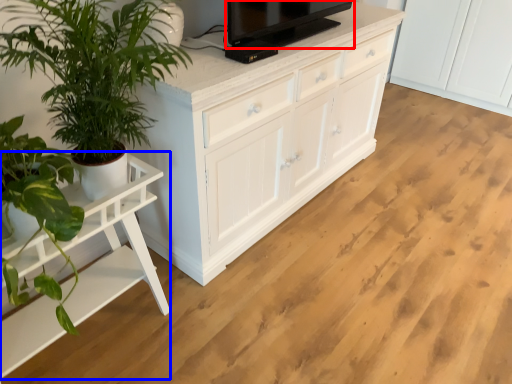
Question: Among these objects, which one is nearest to the camera, television (highlighted by a red box) or table (highlighted by a blue box)?

Choices:
 (A) television
 (B) table

Answer: (B)